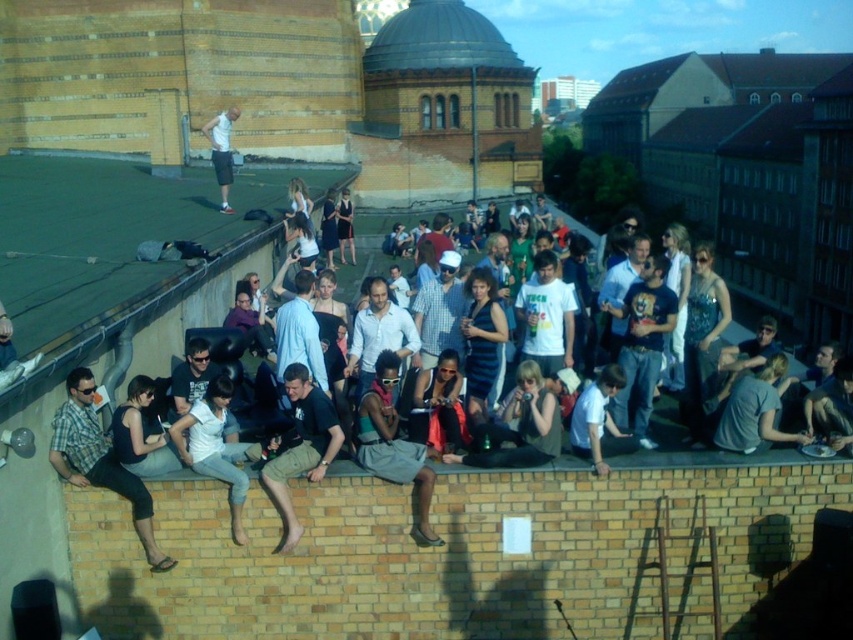
Question: Can you confirm if matte black shirt at center is wider than green fabric skirt at center?

Choices:
 (A) yes
 (B) no

Answer: (A)

Question: Which of the following is the closest to the observer?

Choices:
 (A) (285, 483)
 (B) (219, 472)
 (C) (135, 396)
 (D) (347, 468)

Answer: (B)

Question: Is matte black shirt at lower left to the right of green fabric skirt at center from the viewer's perspective?

Choices:
 (A) no
 (B) yes

Answer: (A)

Question: Which object appears farthest from the camera in this image?

Choices:
 (A) matte black shirt at lower left
 (B) green fabric skirt at center
 (C) black cotton shirt at center

Answer: (B)

Question: Can you confirm if white cotton shirt at center is positioned to the right of black fabric dress at lower left?

Choices:
 (A) yes
 (B) no

Answer: (A)

Question: Estimate the real-world distances between objects in this image. Which object is closer to the matte black shirt at center?

Choices:
 (A) white cotton shirt at upper center
 (B) matte black shirt at lower left

Answer: (B)